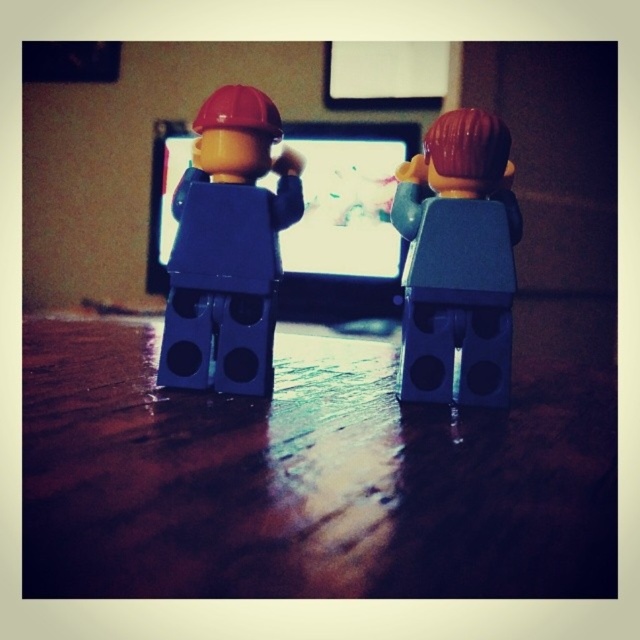
You are a photographer trying to capture a closeup of the LEGO figure on the right. The camera is currently focused on the point at point (x=426, y=451). The photographer wants to know if adjusting the focus to this point will ensure the LEGO figure on the right is in focus. Please answer based on the distance between the point and the camera.

The point at point (x=426, y=451) is 40.04 centimeters from the camera. If the LEGO figure on the right is positioned at this distance, then focusing the camera on this point should bring it into clear focus. However, if the figure is closer or farther away, the focus may need adjustment.

You are a small toy car that is 10 centimeters long. You are placed on the wooden table at center. Can you move freely around the table without falling off?

The wooden table at center is 19.34 centimeters away from the viewer, but this distance does not indicate the table size. Since the table size isn not provided, it is impossible to determine if the toy car can move freely around the table without falling off.

You are organizing a LEGO display and need to place both the wooden table at center and the matte gray minifigure at center on a shelf. If the shelf has limited space, which object should you prioritize placing first to ensure both fit?

The wooden table at center is larger than the matte gray minifigure at center, so you should place the wooden table at center first to ensure both fit on the shelf.